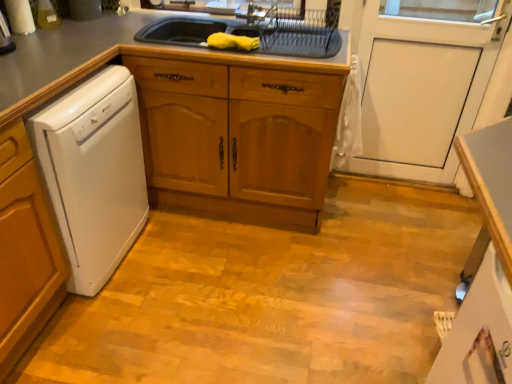
Locate an element on the screen. Image resolution: width=512 pixels, height=384 pixels. vacant space behind white glossy counter at lower right is located at coordinates (376, 256).